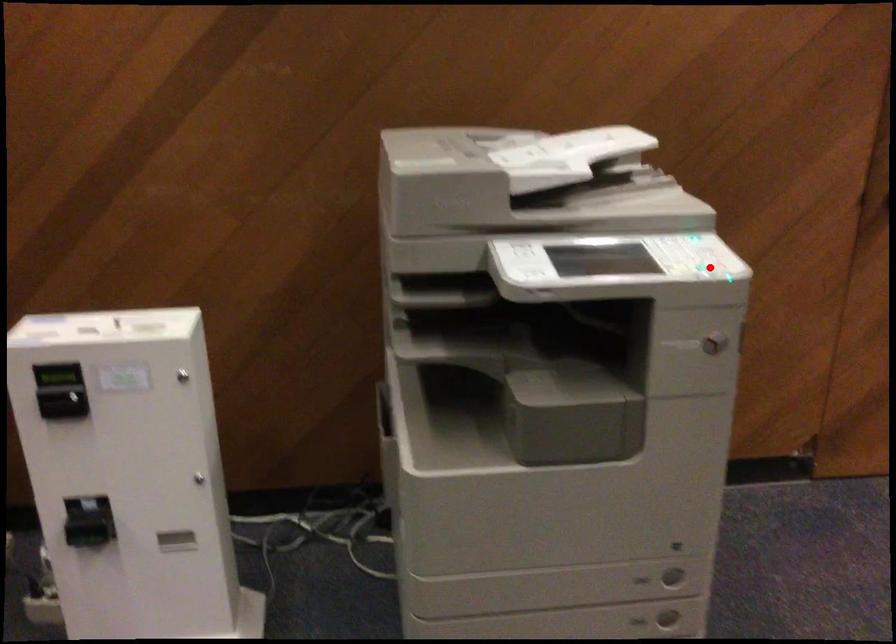
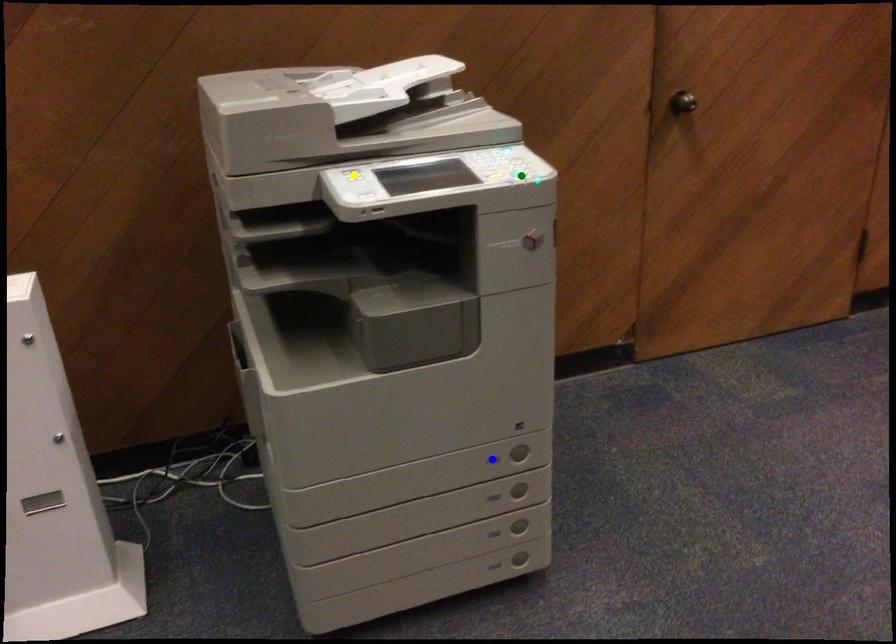
Question: I am providing you with two images of the same scene from different viewpoints. A red point is marked on the first image. You are given multiple points on the second image. In image 2, which mark is for the same physical point as the one in image 1?

Choices:
 (A) yellow point
 (B) blue point
 (C) green point

Answer: (C)